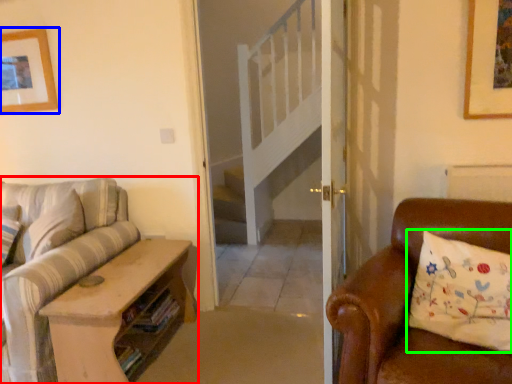
Question: Which is nearer to the studio couch (highlighted by a red box)? picture frame (highlighted by a blue box) or pillow (highlighted by a green box).

Choices:
 (A) picture frame
 (B) pillow

Answer: (A)